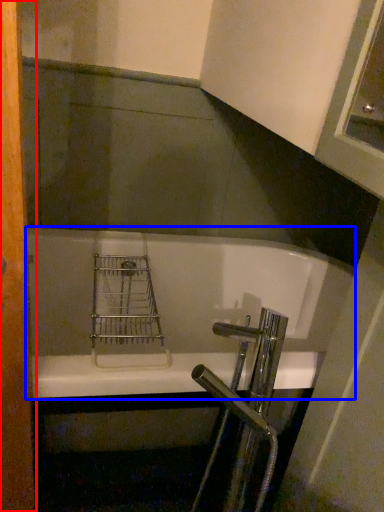
Question: Which point is closer to the camera, screen door (highlighted by a red box) or bathtub (highlighted by a blue box)?

Choices:
 (A) screen door
 (B) bathtub

Answer: (A)